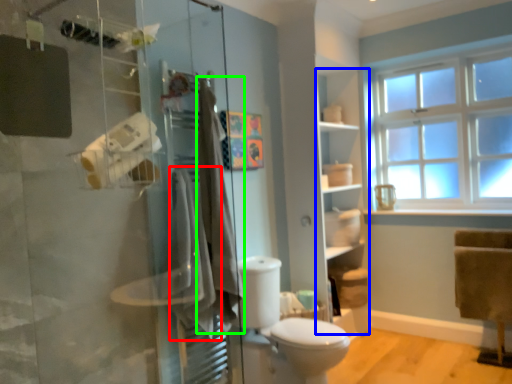
Question: Which is nearer to the bath towel (highlighted by a red box)? shelf (highlighted by a blue box) or bath towel (highlighted by a green box).

Choices:
 (A) shelf
 (B) bath towel

Answer: (B)